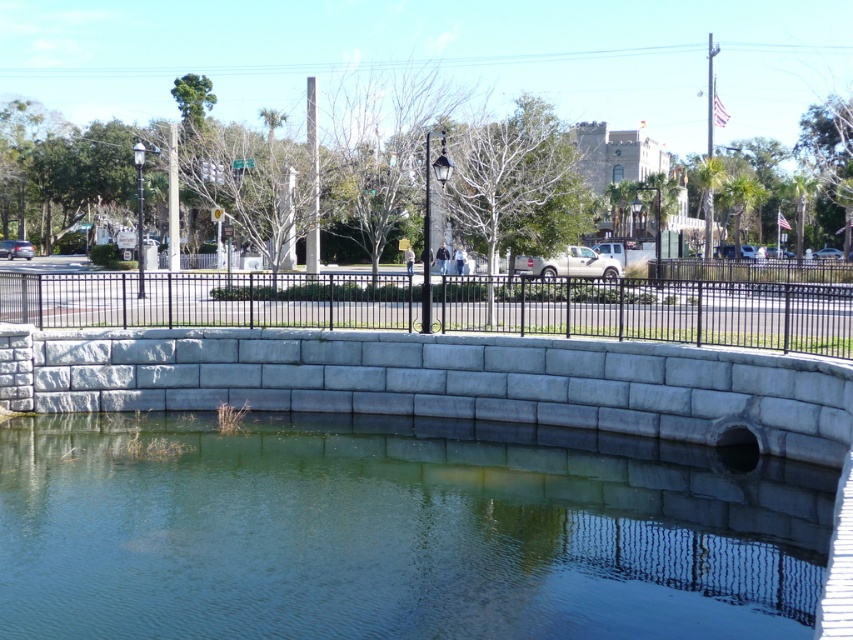
Does gray concrete pool at center appear under black metal fence at center?

Correct, gray concrete pool at center is located below black metal fence at center.

Does gray concrete pool at center have a smaller size compared to black metal fence at center?

Correct, gray concrete pool at center occupies less space than black metal fence at center.

Who is more forward, (415, 451) or (369, 275)?

Point (415, 451) is more forward.

Locate an element on the screen. This screenshot has width=853, height=640. gray concrete pool at center is located at coordinates point(390,534).